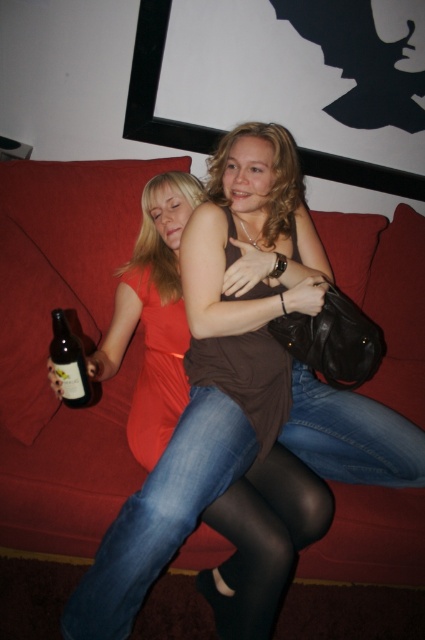
Question: Where is jeans at center located in relation to translucent glass bottle at lower left in the image?

Choices:
 (A) right
 (B) left

Answer: (A)

Question: Based on their relative distances, which object is nearer to the black tights at lower center?

Choices:
 (A) translucent glass bottle at lower left
 (B) red fabric couch at center
 (C) jeans at lower right

Answer: (C)

Question: Can you confirm if red fabric couch at center is smaller than translucent glass bottle at lower left?

Choices:
 (A) no
 (B) yes

Answer: (A)

Question: Among these objects, which one is farthest from the camera?

Choices:
 (A) jeans at lower right
 (B) black tights at lower center

Answer: (A)

Question: Does red fabric couch at center have a lesser width compared to jeans at center?

Choices:
 (A) no
 (B) yes

Answer: (A)

Question: Which object is the closest to the jeans at center?

Choices:
 (A) jeans at lower right
 (B) red fabric couch at center
 (C) translucent glass bottle at lower left
 (D) black tights at lower center

Answer: (D)